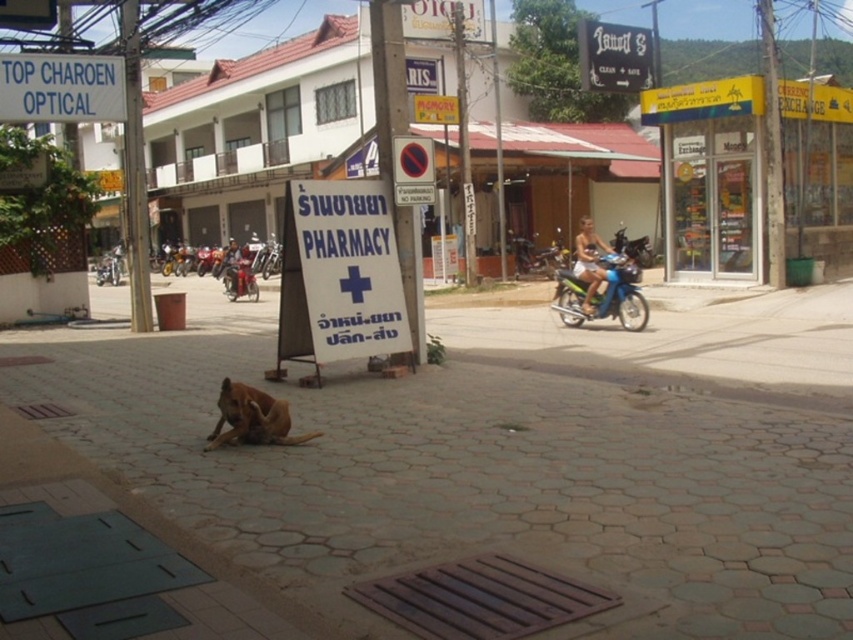
Question: Which object appears closest to the camera in this image?

Choices:
 (A) white plastic sign at upper left
 (B) white cardboard sign at center

Answer: (B)

Question: Can you confirm if white cardboard sign at center is wider than blue metallic motorcycle at center?

Choices:
 (A) no
 (B) yes

Answer: (A)

Question: In this image, where is light brown leather jacket at center located relative to blue metallic motorcycle at center?

Choices:
 (A) right
 (B) left

Answer: (A)

Question: Does white plastic sign at center have a larger size compared to blue metallic motorcycle at center?

Choices:
 (A) no
 (B) yes

Answer: (A)

Question: Which object is closer to the camera taking this photo?

Choices:
 (A) white cardboard sign at center
 (B) reddish-brown leather jacket at center
 (C) white plastic sign at center
 (D) black wood sign at upper center

Answer: (A)

Question: Which point is farther to the camera?

Choices:
 (A) (302, 339)
 (B) (252, 429)

Answer: (A)